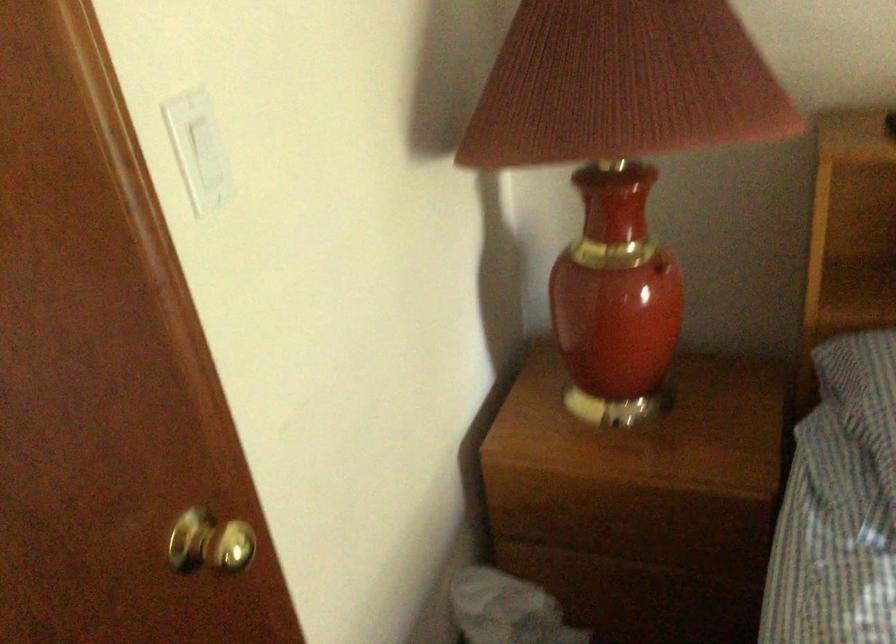
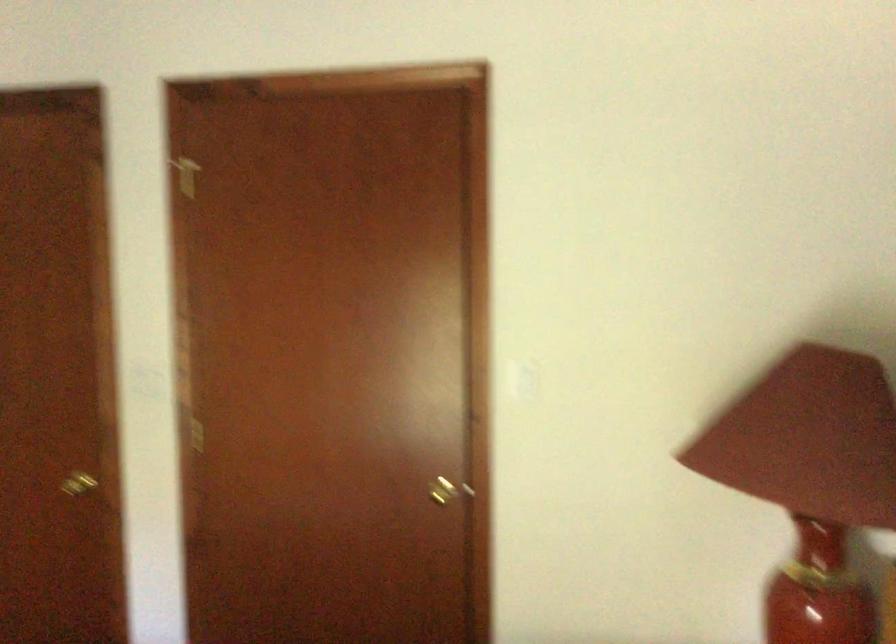
Locate, in the second image, the point that corresponds to point (216, 558) in the first image.

(446, 489)